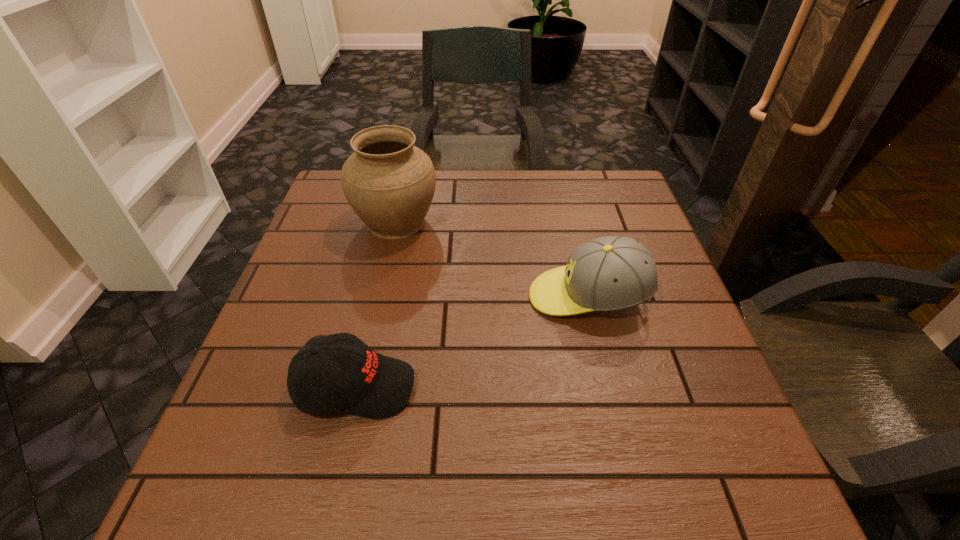
Find the location of a particular element. The image size is (960, 540). free space located 0.070m on the front-facing side of the shorter baseball cap is located at coordinates (454, 387).

Where is `object present at the far edge`? Image resolution: width=960 pixels, height=540 pixels. object present at the far edge is located at coordinates (390, 183).

Image resolution: width=960 pixels, height=540 pixels. Find the location of `urn located at the left edge`. urn located at the left edge is located at coordinates (390, 183).

In order to click on baseball cap that is at the left edge in this screenshot , I will do `click(372, 385)`.

Locate an element on the screen. The image size is (960, 540). object present at the right edge is located at coordinates (610, 273).

Identify the location of object present at the far left corner. (390, 183).

In the image, there is a desktop. Identify the location of vacant space at the far edge. (438, 190).

I want to click on free spot at the left edge of the desktop, so click(x=326, y=284).

Locate an element on the screen. blank space at the right edge of the desktop is located at coordinates (664, 264).

Image resolution: width=960 pixels, height=540 pixels. I want to click on vacant space at the far left corner of the desktop, so pos(341,169).